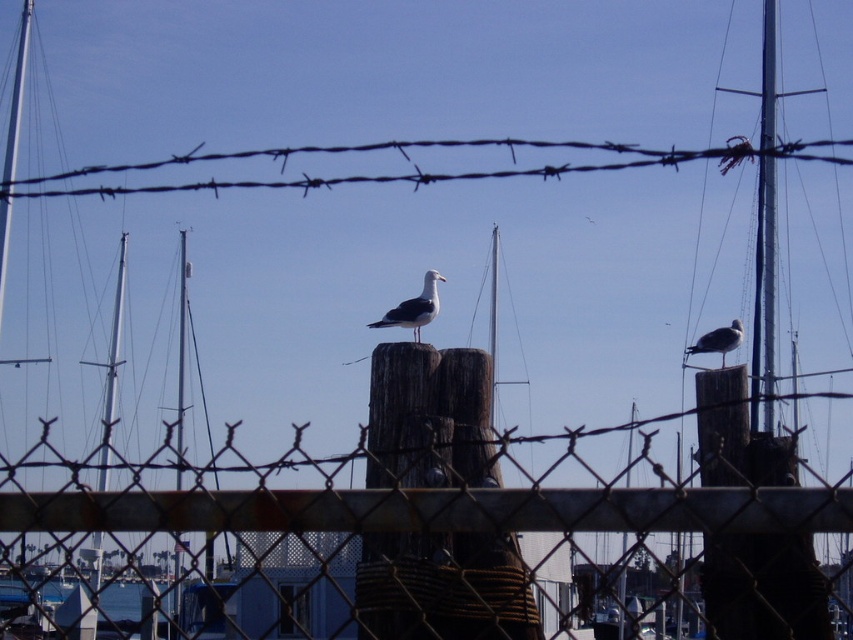
Question: Does metal chain-link fence at center have a larger size compared to barbed wire at upper center?

Choices:
 (A) yes
 (B) no

Answer: (B)

Question: Is metal chain-link fence at center further to the viewer compared to white matte seagull at center?

Choices:
 (A) no
 (B) yes

Answer: (A)

Question: Is white matte seagull at center to the right of white matte seagull at upper right from the viewer's perspective?

Choices:
 (A) no
 (B) yes

Answer: (A)

Question: Which point appears farthest from the camera in this image?

Choices:
 (A) (281, 493)
 (B) (149, 188)
 (C) (419, 333)
 (D) (734, 342)

Answer: (B)

Question: Among these points, which one is farthest from the camera?

Choices:
 (A) (711, 332)
 (B) (68, 518)

Answer: (A)

Question: Among these points, which one is nearest to the camera?

Choices:
 (A) (306, 500)
 (B) (283, 152)
 (C) (730, 321)

Answer: (A)